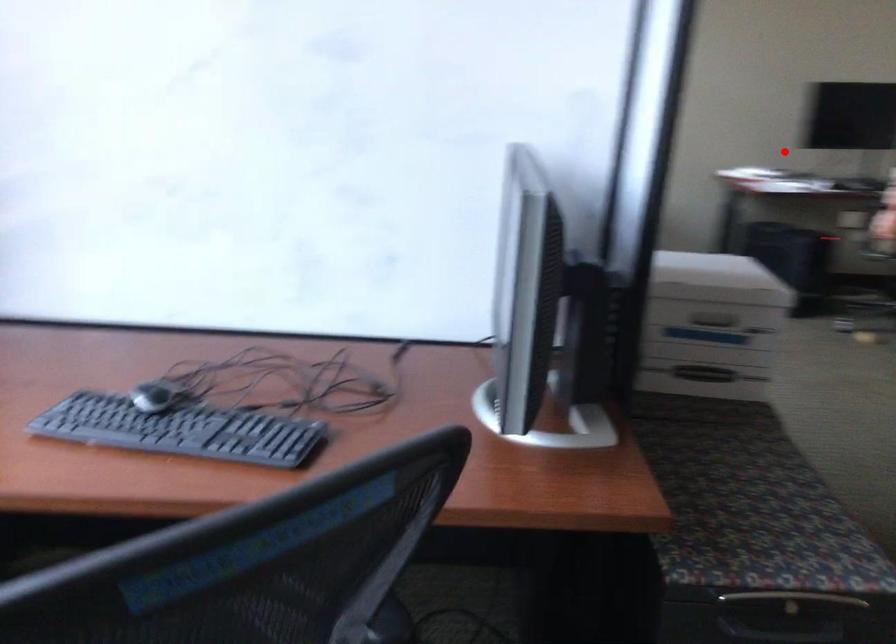
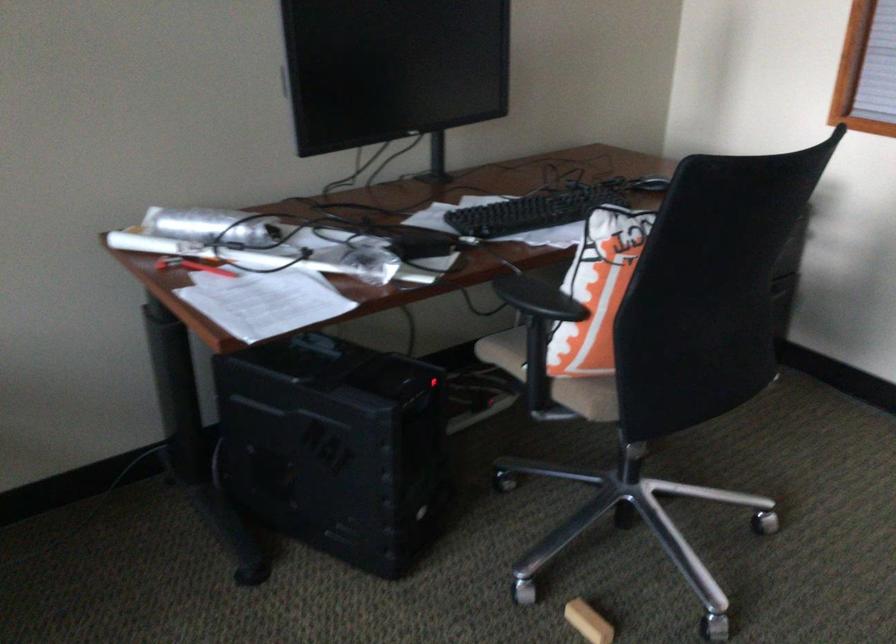
The point at the highlighted location is marked in the first image. Where is the corresponding point in the second image?

(192, 266)